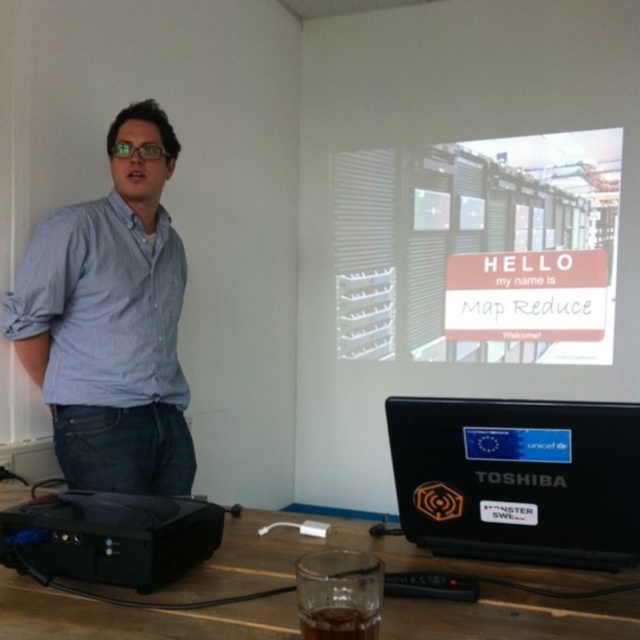
The width and height of the screenshot is (640, 640). Identify the location of white matte signboard at upper center. (477, 250).

Does white matte signboard at upper center have a lesser height compared to blue denim jeans at left?

Indeed, white matte signboard at upper center has a lesser height compared to blue denim jeans at left.

Between point (390, 307) and point (83, 365), which one is positioned in front?

Positioned in front is point (83, 365).

You are a GUI agent. You are given a task and a screenshot of the screen. Output one action in this format:
    pyautogui.click(x=<x>, y=<y>)
    Task: Click on the white matte signboard at upper center
    
    Given the screenshot: What is the action you would take?
    pyautogui.click(x=477, y=250)

Image resolution: width=640 pixels, height=640 pixels. What do you see at coordinates (477, 250) in the screenshot? I see `white matte signboard at upper center` at bounding box center [477, 250].

The height and width of the screenshot is (640, 640). Find the location of `white matte signboard at upper center`. white matte signboard at upper center is located at coordinates (477, 250).

Who is more forward, (156, 552) or (362, 634)?

Point (362, 634) is in front.

Based on the photo, can you confirm if black plastic projector at lower left is thinner than brown glass at lower center?

No.

Between point (113, 522) and point (339, 593), which one is positioned in front?

Positioned in front is point (339, 593).

Where is `black plastic projector at lower left`? black plastic projector at lower left is located at coordinates (113, 538).